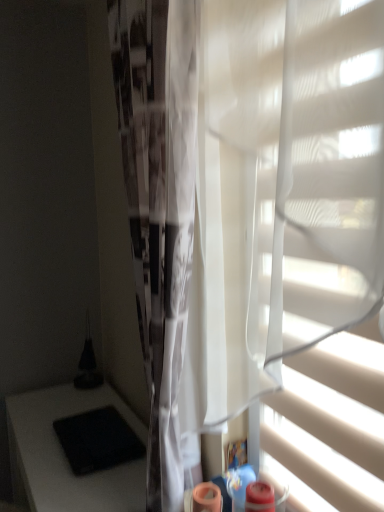
In order to click on empty space that is ontop of black matte pad at lower left (from a real-world perspective) in this screenshot , I will do `click(89, 432)`.